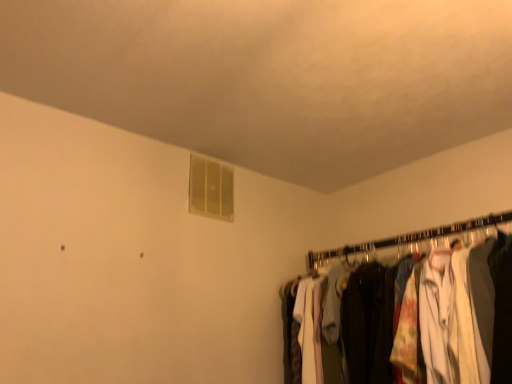
Question: From a real-world perspective, relative to white fabric clothes at right, is translucent plastic window at upper center vertically above or below?

Choices:
 (A) above
 (B) below

Answer: (A)

Question: Which is correct: translucent plastic window at upper center is inside white fabric clothes at right, or outside of it?

Choices:
 (A) inside
 (B) outside

Answer: (B)

Question: Considering the positions of point (197, 158) and point (330, 253), is point (197, 158) closer or farther from the camera than point (330, 253)?

Choices:
 (A) farther
 (B) closer

Answer: (B)

Question: Is point tap(506, 215) positioned closer to the camera than point tap(225, 213)?

Choices:
 (A) farther
 (B) closer

Answer: (B)

Question: Considering the positions of white fabric clothes at right and translucent plastic window at upper center in the image, is white fabric clothes at right bigger or smaller than translucent plastic window at upper center?

Choices:
 (A) small
 (B) big

Answer: (B)

Question: Choose the correct answer: Is white fabric clothes at right inside translucent plastic window at upper center or outside it?

Choices:
 (A) outside
 (B) inside

Answer: (A)

Question: Visually, is white fabric clothes at right positioned to the left or to the right of translucent plastic window at upper center?

Choices:
 (A) right
 (B) left

Answer: (A)